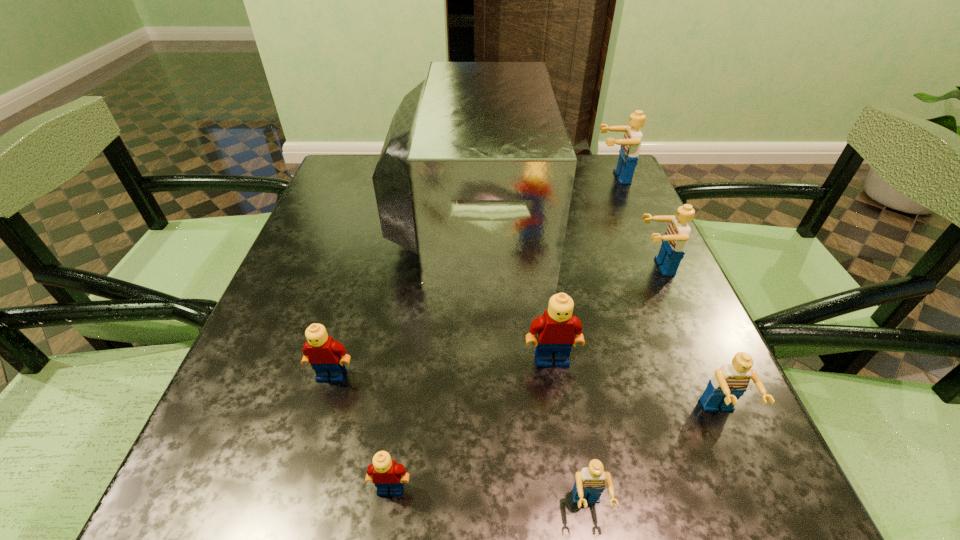
Locate which yellow Lego ranks second in proximity to the microwave oven. Please provide its 2D coordinates. Your answer should be formatted as a tuple, i.e. [(x, y)], where the tuple contains the x and y coordinates of a point satisfying the conditions above.

[(326, 356)]

You are a GUI agent. You are given a task and a screenshot of the screen. Output one action in this format:
    pyautogui.click(x=<x>, y=<y>)
    Task: Click on the closest yellow Lego to the second tallest object
    
    Given the screenshot: What is the action you would take?
    pyautogui.click(x=558, y=330)

Where is `free space in the image that satisfies the following two spatial constraints: 1. on the face of the biggest blue Lego; 2. on the front-facing side of the nearest yellow Lego`? This screenshot has width=960, height=540. free space in the image that satisfies the following two spatial constraints: 1. on the face of the biggest blue Lego; 2. on the front-facing side of the nearest yellow Lego is located at coordinates (745, 488).

Image resolution: width=960 pixels, height=540 pixels. What are the coordinates of `vacant space that satisfies the following two spatial constraints: 1. on the front-facing side of the white microwave oven; 2. on the front-facing side of the nearest yellow Lego` in the screenshot? It's located at (466, 488).

At what (x,y) coordinates should I click in order to perform the action: click on free space that satisfies the following two spatial constraints: 1. on the face of the second tallest object; 2. on the face of the nearest blue Lego. Please return your answer as a coordinate pair (x, y). The image size is (960, 540). Looking at the image, I should click on (753, 507).

Locate an element on the screen. The height and width of the screenshot is (540, 960). vacant space that satisfies the following two spatial constraints: 1. on the face of the biggest blue Lego; 2. on the front-facing side of the second yellow Lego from left to right is located at coordinates (745, 488).

The image size is (960, 540). What are the coordinates of `vacant region that satisfies the following two spatial constraints: 1. on the face of the third smallest blue Lego; 2. on the front-facing side of the biggest yellow Lego` in the screenshot? It's located at (695, 359).